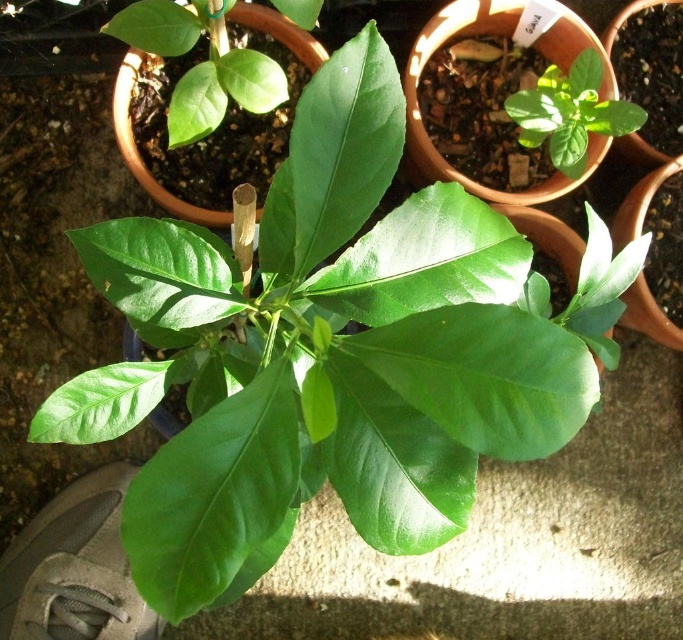
You are a gardener trying to water two leaves on a plant. You have a watering can that can spray water up to 22 inches. The leaves are the glossy green leaf at upper left and the green matte leaf at upper right. Can you water both leaves without moving the watering can?

The glossy green leaf at upper left and the green matte leaf at upper right are 21.98 inches apart. Since the watering can can spray up to 22 inches, you can water both leaves without moving the watering can because the distance between them is within the spray range.

You are taking a photo of the plant and want to focus on both the point at point (x=309, y=13) and the point at point (x=550, y=132). Which point should you adjust your focus to first to ensure both are in clear view?

Point (x=309, y=13) is closer to the camera than point (x=550, y=132). To ensure both are in focus, you should adjust your focus starting from the closer point (x=309, y=13) first, then gradually adjust towards the farther point (x=550, y=132).

Based on the photo, based on the scene description, where is the glossy green leaf at upper left located in terms of its 2D coordinates?

The glossy green leaf at upper left is located at the 2D coordinates of point (223,83).